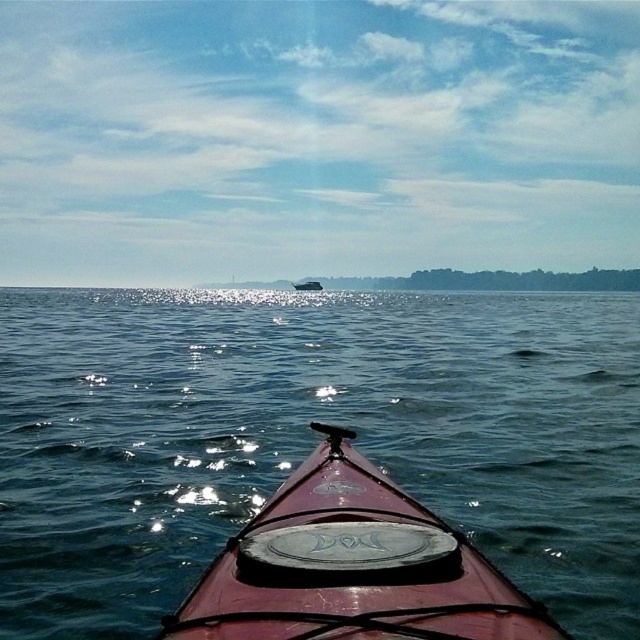
You are kayaking and want to check the water surface in front of your kayak. Based on the scene, is the glossy water at center located above or below the shiny red kayak at center?

The glossy water at center is above the shiny red kayak at center according to the description.

You are in a kayak and want to reach a point marked at coordinates point (x=120, y=406). Given that your kayak can travel at 2 meters per second, how long will it take you to reach that point?

The distance between you and point (x=120, y=406) is 17.08 meters. At a speed of 2 meters per second, it will take approximately 8.54 seconds to reach the point.